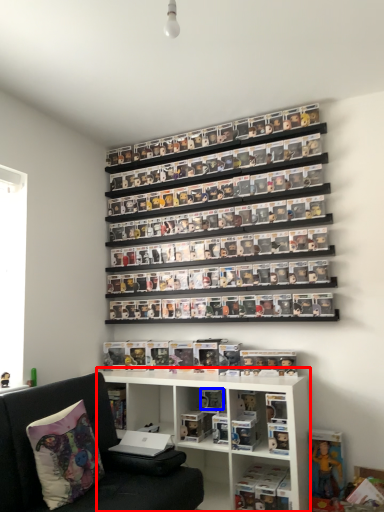
Question: Among these objects, which one is farthest to the camera, shelf (highlighted by a red box) or toy (highlighted by a blue box)?

Choices:
 (A) shelf
 (B) toy

Answer: (B)